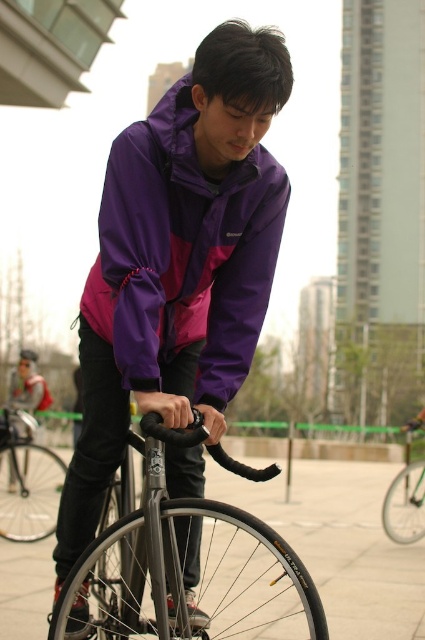
Does shiny black frame at center appear on the right side of matte black jacket at center?

Yes, shiny black frame at center is to the right of matte black jacket at center.

Image resolution: width=425 pixels, height=640 pixels. In order to click on shiny black frame at center in this screenshot , I will do `click(172, 557)`.

Which is above, purple matte jacket at center or purple/matte jacket at center?

purple matte jacket at center is higher up.

Which is in front, point (218, 106) or point (144, 244)?

Positioned in front is point (218, 106).

Where is `purple matte jacket at center`? purple matte jacket at center is located at coordinates (178, 262).

Is purple/matte jacket at center in front of shiny silver bicycle at center?

Yes, it is.

Between point (152, 253) and point (405, 481), which one is positioned in front?

Positioned in front is point (152, 253).

The image size is (425, 640). Identify the location of purple/matte jacket at center. (183, 253).

Where is `purple/matte jacket at center`? purple/matte jacket at center is located at coordinates (183, 253).